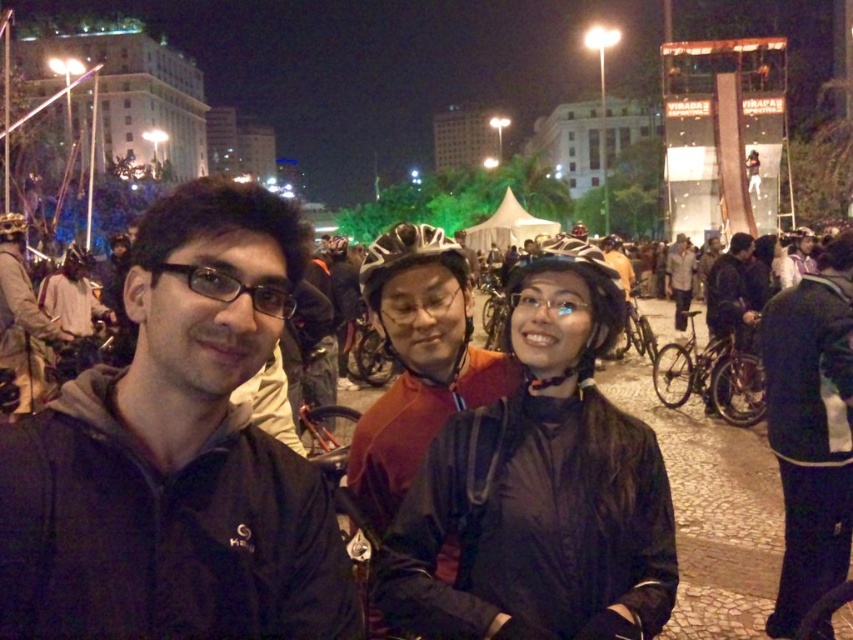
Who is more distant from viewer, (22,412) or (276,307)?

The point (22,412) is more distant.

What do you see at coordinates (21, 316) in the screenshot? This screenshot has width=853, height=640. I see `dark brown leather jacket at left` at bounding box center [21, 316].

The image size is (853, 640). Find the location of `dark brown leather jacket at left`. dark brown leather jacket at left is located at coordinates (21, 316).

Does black matte jacket at center appear on the left side of dark blue jacket at lower right?

Correct, you'll find black matte jacket at center to the left of dark blue jacket at lower right.

How far apart are black matte jacket at center and dark blue jacket at lower right?

black matte jacket at center is 30.83 meters from dark blue jacket at lower right.

Does point (187, 180) come in front of point (808, 580)?

That is False.

This screenshot has height=640, width=853. What are the coordinates of `black matte jacket at center` in the screenshot? It's located at pyautogui.click(x=177, y=456).

Which is more to the right, black matte jacket at center or black matte helmet at center?

Positioned to the right is black matte helmet at center.

Measure the distance between black matte jacket at center and camera.

black matte jacket at center is 28.34 meters from camera.

Image resolution: width=853 pixels, height=640 pixels. I want to click on black matte jacket at center, so click(x=177, y=456).